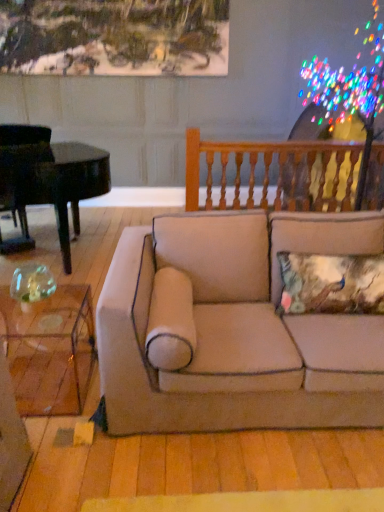
Question: Would you say beige fabric couch at center contains wooden balusters at upper right?

Choices:
 (A) yes
 (B) no

Answer: (B)

Question: Can you confirm if beige fabric couch at center is bigger than wooden balusters at upper right?

Choices:
 (A) no
 (B) yes

Answer: (B)

Question: From a real-world perspective, is beige fabric couch at center physically below wooden balusters at upper right?

Choices:
 (A) yes
 (B) no

Answer: (A)

Question: Does beige fabric couch at center turn towards wooden balusters at upper right?

Choices:
 (A) no
 (B) yes

Answer: (A)

Question: Is beige fabric couch at center to the right of wooden balusters at upper right from the viewer's perspective?

Choices:
 (A) no
 (B) yes

Answer: (A)

Question: In terms of height, does black polished piano at left look taller or shorter compared to transparent glass coffee table at lower left?

Choices:
 (A) short
 (B) tall

Answer: (B)

Question: Considering the relative positions of black polished piano at left and transparent glass coffee table at lower left in the image provided, is black polished piano at left to the left or to the right of transparent glass coffee table at lower left?

Choices:
 (A) left
 (B) right

Answer: (A)

Question: Looking at their shapes, would you say black polished piano at left is wider or thinner than transparent glass coffee table at lower left?

Choices:
 (A) thin
 (B) wide

Answer: (B)

Question: From a real-world perspective, is black polished piano at left above or below transparent glass coffee table at lower left?

Choices:
 (A) below
 (B) above

Answer: (B)

Question: Is transparent glass coffee table at lower left spatially inside wooden balusters at upper right, or outside of it?

Choices:
 (A) inside
 (B) outside

Answer: (B)

Question: From a real-world perspective, is transparent glass coffee table at lower left above or below wooden balusters at upper right?

Choices:
 (A) above
 (B) below

Answer: (B)

Question: In terms of height, does transparent glass coffee table at lower left look taller or shorter compared to wooden balusters at upper right?

Choices:
 (A) short
 (B) tall

Answer: (A)

Question: From the image's perspective, is transparent glass coffee table at lower left above or below wooden balusters at upper right?

Choices:
 (A) above
 (B) below

Answer: (B)

Question: From the image's perspective, is beige fabric couch at center located above or below transparent glass coffee table at lower left?

Choices:
 (A) below
 (B) above

Answer: (B)

Question: Do you think beige fabric couch at center is within transparent glass coffee table at lower left, or outside of it?

Choices:
 (A) outside
 (B) inside

Answer: (A)